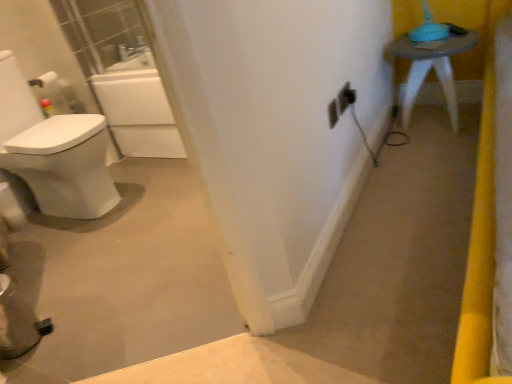
Describe the element at coordinates (350, 95) in the screenshot. I see `matte black outlet at center-right, placed as the 1th electric outlet when sorted from right to left` at that location.

Describe the element at coordinates (333, 112) in the screenshot. I see `white plastic electric outlet at center, marked as the first electric outlet in a left-to-right arrangement` at that location.

The height and width of the screenshot is (384, 512). Find the location of `black plastic outlet at center, the 2th electric outlet viewed from the left`. black plastic outlet at center, the 2th electric outlet viewed from the left is located at coordinates (345, 98).

This screenshot has width=512, height=384. Identify the location of matte black outlet at center-right, the third electric outlet positioned from the left. (350, 95).

Is matte gray stool at upper right further to the viewer compared to matte black outlet at center-right, placed as the 1th electric outlet when sorted from right to left?

Yes, it is behind matte black outlet at center-right, placed as the 1th electric outlet when sorted from right to left.

Is matte gray stool at upper right shorter than matte black outlet at center-right, placed as the 1th electric outlet when sorted from right to left?

In fact, matte gray stool at upper right may be taller than matte black outlet at center-right, placed as the 1th electric outlet when sorted from right to left.

Looking at their sizes, would you say matte gray stool at upper right is wider or thinner than matte black outlet at center-right, the third electric outlet positioned from the left?

Clearly, matte gray stool at upper right has more width compared to matte black outlet at center-right, the third electric outlet positioned from the left.

Consider the image. Considering the positions of objects matte gray stool at upper right and matte black outlet at center-right, placed as the 1th electric outlet when sorted from right to left, in the image provided, who is more to the right, matte gray stool at upper right or matte black outlet at center-right, placed as the 1th electric outlet when sorted from right to left,?

From the viewer's perspective, matte gray stool at upper right appears more on the right side.

Are black plastic outlet at center, the 2th electric outlet viewed from the left, and matte gray stool at upper right located far from each other?

black plastic outlet at center, the 2th electric outlet viewed from the left, is actually quite close to matte gray stool at upper right.

Between black plastic outlet at center, the 2th electric outlet when ordered from right to left, and matte gray stool at upper right, which one has smaller width?

black plastic outlet at center, the 2th electric outlet when ordered from right to left.

Which object is positioned more to the left, black plastic outlet at center, the 2th electric outlet when ordered from right to left, or matte gray stool at upper right?

Positioned to the left is black plastic outlet at center, the 2th electric outlet when ordered from right to left.

From a real-world perspective, relative to matte gray stool at upper right, is black plastic outlet at center, the 2th electric outlet when ordered from right to left, vertically above or below?

Clearly, from a real-world perspective, black plastic outlet at center, the 2th electric outlet when ordered from right to left, is above matte gray stool at upper right.

Does point (347, 93) come in front of point (340, 98)?

No, (347, 93) is further to viewer.

From a real-world perspective, which is physically above, matte black outlet at center-right, the third electric outlet positioned from the left, or black plastic outlet at center, the 2th electric outlet when ordered from right to left?

black plastic outlet at center, the 2th electric outlet when ordered from right to left, is physically above.

Is matte black outlet at center-right, placed as the 1th electric outlet when sorted from right to left, facing away from black plastic outlet at center, the 2th electric outlet viewed from the left?

Yes, matte black outlet at center-right, placed as the 1th electric outlet when sorted from right to left, is facing away from black plastic outlet at center, the 2th electric outlet viewed from the left.

In terms of width, does matte black outlet at center-right, the third electric outlet positioned from the left, look wider or thinner when compared to black plastic outlet at center, the 2th electric outlet when ordered from right to left?

matte black outlet at center-right, the third electric outlet positioned from the left, is wider than black plastic outlet at center, the 2th electric outlet when ordered from right to left.

From the image's perspective, which is below, matte gray stool at upper right or black plastic outlet at center, the 2th electric outlet when ordered from right to left?

black plastic outlet at center, the 2th electric outlet when ordered from right to left, is shown below in the image.

Are matte gray stool at upper right and black plastic outlet at center, the 2th electric outlet viewed from the left, beside each other?

No, matte gray stool at upper right is not making contact with black plastic outlet at center, the 2th electric outlet viewed from the left.

Considering the relative sizes of matte gray stool at upper right and black plastic outlet at center, the 2th electric outlet viewed from the left, in the image provided, is matte gray stool at upper right wider than black plastic outlet at center, the 2th electric outlet viewed from the left,?

Indeed, matte gray stool at upper right has a greater width compared to black plastic outlet at center, the 2th electric outlet viewed from the left.

Is matte gray stool at upper right behind black plastic outlet at center, the 2th electric outlet when ordered from right to left?

Yes, the depth of matte gray stool at upper right is greater than that of black plastic outlet at center, the 2th electric outlet when ordered from right to left.

What's the angular difference between black plastic outlet at center, the 2th electric outlet viewed from the left, and white plastic electric outlet at center, which is counted as the third electric outlet, starting from the right,'s facing directions?

5.59 degrees.

Choose the correct answer: Is black plastic outlet at center, the 2th electric outlet viewed from the left, inside white plastic electric outlet at center, marked as the first electric outlet in a left-to-right arrangement, or outside it?

black plastic outlet at center, the 2th electric outlet viewed from the left, is outside white plastic electric outlet at center, marked as the first electric outlet in a left-to-right arrangement.

Is black plastic outlet at center, the 2th electric outlet viewed from the left, placed right next to white plastic electric outlet at center, which is counted as the third electric outlet, starting from the right?

Indeed, black plastic outlet at center, the 2th electric outlet viewed from the left, and white plastic electric outlet at center, which is counted as the third electric outlet, starting from the right, are beside each other and touching.

From the white plastic electric outlet at center, which is counted as the third electric outlet, starting from the right, count 1st electric outlet to the right and point to it. Please provide its 2D coordinates.

[(345, 98)]

Considering the points (412, 54) and (329, 112), which point is in front, point (412, 54) or point (329, 112)?

Point (329, 112)

Is matte gray stool at upper right facing towards white plastic electric outlet at center, marked as the first electric outlet in a left-to-right arrangement?

Yes, matte gray stool at upper right is oriented towards white plastic electric outlet at center, marked as the first electric outlet in a left-to-right arrangement.

Is matte gray stool at upper right placed right next to white plastic electric outlet at center, marked as the first electric outlet in a left-to-right arrangement?

No, matte gray stool at upper right is not with white plastic electric outlet at center, marked as the first electric outlet in a left-to-right arrangement.

From the image's perspective, is matte gray stool at upper right above or below white plastic electric outlet at center, which is counted as the third electric outlet, starting from the right?

Clearly, from the image's perspective, matte gray stool at upper right is above white plastic electric outlet at center, which is counted as the third electric outlet, starting from the right.

Which point is more forward, [348,92] or [331,128]?

The point [331,128] is in front.

Can you confirm if matte black outlet at center-right, the third electric outlet positioned from the left, is thinner than white plastic electric outlet at center, marked as the first electric outlet in a left-to-right arrangement?

Yes.

From a real-world perspective, is matte black outlet at center-right, placed as the 1th electric outlet when sorted from right to left, positioned over white plastic electric outlet at center, which is counted as the third electric outlet, starting from the right, based on gravity?

No, from a real-world perspective, matte black outlet at center-right, placed as the 1th electric outlet when sorted from right to left, is not above white plastic electric outlet at center, which is counted as the third electric outlet, starting from the right.

Where is `the 1st electric outlet in front of the matte gray stool at upper right`? This screenshot has height=384, width=512. the 1st electric outlet in front of the matte gray stool at upper right is located at coordinates point(350,95).

There is a matte gray stool at upper right. Where is `the 2nd electric outlet below it (from the image's perspective)`? The width and height of the screenshot is (512, 384). the 2nd electric outlet below it (from the image's perspective) is located at coordinates (x=345, y=98).

In the scene shown: When comparing their distances from white plastic electric outlet at center, which is counted as the third electric outlet, starting from the right, does matte gray stool at upper right or matte black outlet at center-right, placed as the 1th electric outlet when sorted from right to left, seem closer?

matte black outlet at center-right, placed as the 1th electric outlet when sorted from right to left.

From the image, which object appears to be nearer to matte black outlet at center-right, the third electric outlet positioned from the left, matte gray stool at upper right or white plastic electric outlet at center, marked as the first electric outlet in a left-to-right arrangement?

Among the two, white plastic electric outlet at center, marked as the first electric outlet in a left-to-right arrangement, is located nearer to matte black outlet at center-right, the third electric outlet positioned from the left.

When comparing their distances from black plastic outlet at center, the 2th electric outlet viewed from the left, does matte black outlet at center-right, the third electric outlet positioned from the left, or white plastic electric outlet at center, which is counted as the third electric outlet, starting from the right, seem further?

white plastic electric outlet at center, which is counted as the third electric outlet, starting from the right, is positioned further to the anchor black plastic outlet at center, the 2th electric outlet viewed from the left.

Looking at the image, which one is located further to black plastic outlet at center, the 2th electric outlet viewed from the left, matte black outlet at center-right, placed as the 1th electric outlet when sorted from right to left, or matte gray stool at upper right?

The object further to black plastic outlet at center, the 2th electric outlet viewed from the left, is matte gray stool at upper right.

Considering their positions, is black plastic outlet at center, the 2th electric outlet when ordered from right to left, positioned further to matte gray stool at upper right than white plastic electric outlet at center, which is counted as the third electric outlet, starting from the right?

Among the two, white plastic electric outlet at center, which is counted as the third electric outlet, starting from the right, is located further to matte gray stool at upper right.

Looking at the image, which one is located further to black plastic outlet at center, the 2th electric outlet viewed from the left, matte gray stool at upper right or matte black outlet at center-right, the third electric outlet positioned from the left?

matte gray stool at upper right is further to black plastic outlet at center, the 2th electric outlet viewed from the left.

When comparing their distances from white plastic electric outlet at center, which is counted as the third electric outlet, starting from the right, does matte black outlet at center-right, placed as the 1th electric outlet when sorted from right to left, or black plastic outlet at center, the 2th electric outlet when ordered from right to left, seem closer?

black plastic outlet at center, the 2th electric outlet when ordered from right to left, lies closer to white plastic electric outlet at center, which is counted as the third electric outlet, starting from the right, than the other object.

Looking at the image, which one is located further to matte gray stool at upper right, white plastic electric outlet at center, which is counted as the third electric outlet, starting from the right, or matte black outlet at center-right, placed as the 1th electric outlet when sorted from right to left?

white plastic electric outlet at center, which is counted as the third electric outlet, starting from the right, lies further to matte gray stool at upper right than the other object.

I want to click on electric outlet located between black plastic outlet at center, the 2th electric outlet when ordered from right to left, and matte gray stool at upper right in the left-right direction, so click(x=350, y=95).

Find the location of a particular element. The height and width of the screenshot is (384, 512). electric outlet between white plastic electric outlet at center, marked as the first electric outlet in a left-to-right arrangement, and matte black outlet at center-right, placed as the 1th electric outlet when sorted from right to left, in the front-back direction is located at coordinates (345, 98).